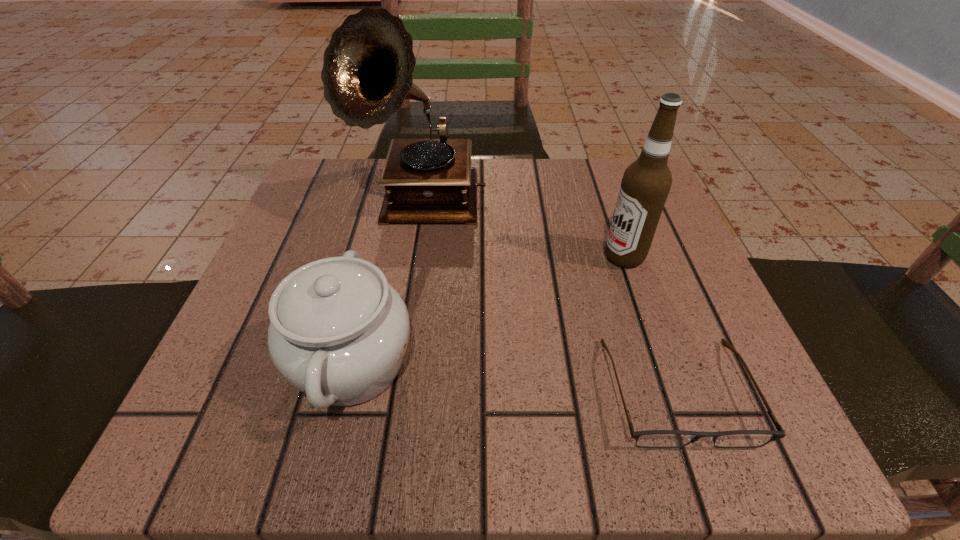
The width and height of the screenshot is (960, 540). Identify the location of the farthest object. (368, 67).

What are the coordinates of `the tallest object` in the screenshot? It's located at (368, 67).

Identify the location of the second tallest object. The width and height of the screenshot is (960, 540). (646, 183).

Locate an element on the screen. The height and width of the screenshot is (540, 960). the second farthest object is located at coordinates (646, 183).

Where is `chinaware`? The width and height of the screenshot is (960, 540). chinaware is located at coordinates (338, 333).

At what (x,y) coordinates should I click in order to perform the action: click on the shortest object. Please return your answer as a coordinate pair (x, y). Looking at the image, I should click on (651, 438).

Locate an element on the screen. Image resolution: width=960 pixels, height=540 pixels. vacant region located on the horn of the tallest object is located at coordinates (410, 263).

I want to click on vacant space situated 0.390m on the label of the third shortest object, so click(383, 257).

Where is `vacant space located on the label of the third shortest object`? vacant space located on the label of the third shortest object is located at coordinates (444, 257).

Where is `free region located on the label of the third shortest object`? The height and width of the screenshot is (540, 960). free region located on the label of the third shortest object is located at coordinates (530, 257).